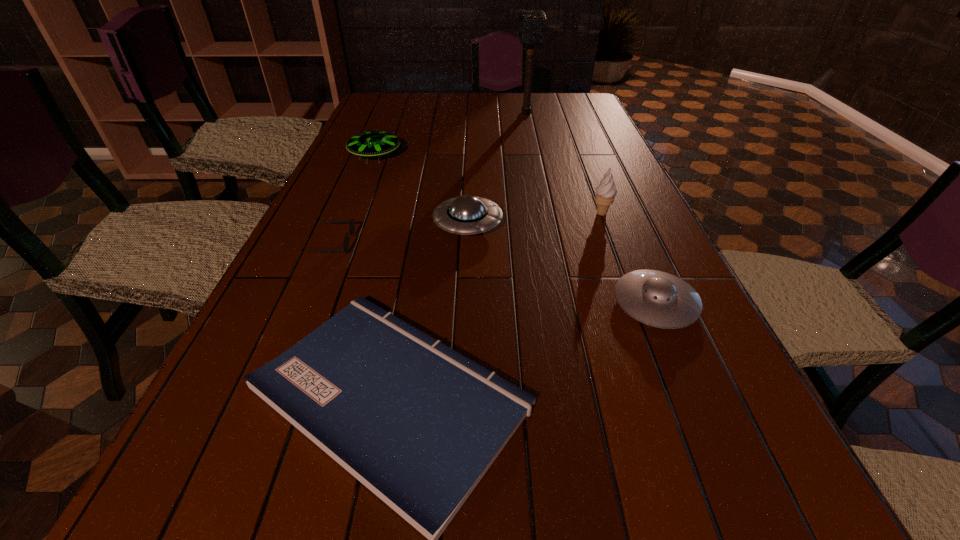
Locate which object ranks in proximity to the sixth shortest object. Please provide its 2D coordinates. Your answer should be formatted as a tuple, i.e. [(x, y)], where the tuple contains the x and y coordinates of a point satisfying the conditions above.

[(658, 299)]

You are a GUI agent. You are given a task and a screenshot of the screen. Output one action in this format:
    pyautogui.click(x=<x>, y=<y>)
    Task: Click on the closest saucer relative to the fifth object from left to right
    The image size is (960, 540).
    Given the screenshot: What is the action you would take?
    pyautogui.click(x=371, y=143)

Where is `saucer that stands as the third closest to the sunglasses`? The image size is (960, 540). saucer that stands as the third closest to the sunglasses is located at coordinates (658, 299).

Identify the location of vacant region that satisfies the following two spatial constraints: 1. on the front-facing side of the second tallest object; 2. on the left side of the nearest saucer. This screenshot has height=540, width=960. (636, 303).

Where is `vacant space that satisfies the following two spatial constraints: 1. on the front side of the farthest saucer; 2. on the left side of the second saucer from left to right`? This screenshot has height=540, width=960. vacant space that satisfies the following two spatial constraints: 1. on the front side of the farthest saucer; 2. on the left side of the second saucer from left to right is located at coordinates (348, 224).

The width and height of the screenshot is (960, 540). I want to click on vacant space that satisfies the following two spatial constraints: 1. on the back side of the third object from right to left; 2. on the right side of the second saucer from left to right, so click(472, 113).